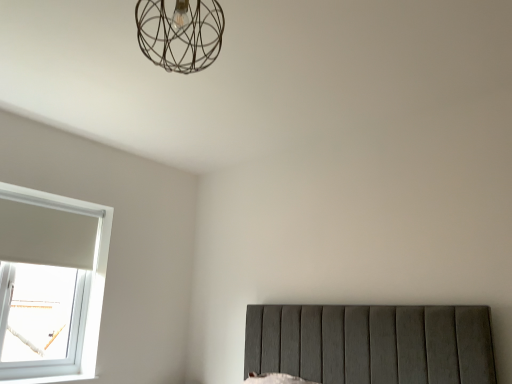
Question: Considering the relative sizes of metallic wire cage at upper center and transparent glass window at lower left in the image provided, is metallic wire cage at upper center thinner than transparent glass window at lower left?

Choices:
 (A) yes
 (B) no

Answer: (B)

Question: Are metallic wire cage at upper center and transparent glass window at lower left beside each other?

Choices:
 (A) yes
 (B) no

Answer: (B)

Question: Is metallic wire cage at upper center turned away from transparent glass window at lower left?

Choices:
 (A) yes
 (B) no

Answer: (B)

Question: Can you confirm if metallic wire cage at upper center is bigger than transparent glass window at lower left?

Choices:
 (A) yes
 (B) no

Answer: (B)

Question: Are metallic wire cage at upper center and transparent glass window at lower left far apart?

Choices:
 (A) no
 (B) yes

Answer: (B)

Question: From a real-world perspective, is metallic wire cage at upper center on top of transparent glass window at lower left?

Choices:
 (A) yes
 (B) no

Answer: (A)

Question: From a real-world perspective, is transparent glass window at lower left physically above metallic wire cage at upper center?

Choices:
 (A) yes
 (B) no

Answer: (B)

Question: Is the position of transparent glass window at lower left more distant than that of metallic wire cage at upper center?

Choices:
 (A) yes
 (B) no

Answer: (A)

Question: Can you confirm if transparent glass window at lower left is shorter than metallic wire cage at upper center?

Choices:
 (A) no
 (B) yes

Answer: (A)

Question: Is transparent glass window at lower left next to metallic wire cage at upper center and touching it?

Choices:
 (A) yes
 (B) no

Answer: (B)

Question: Considering the relative sizes of transparent glass window at lower left and metallic wire cage at upper center in the image provided, is transparent glass window at lower left thinner than metallic wire cage at upper center?

Choices:
 (A) no
 (B) yes

Answer: (B)

Question: Is transparent glass window at lower left taller than metallic wire cage at upper center?

Choices:
 (A) yes
 (B) no

Answer: (A)

Question: From the image's perspective, is metallic wire cage at upper center above or below transparent glass window at lower left?

Choices:
 (A) below
 (B) above

Answer: (B)